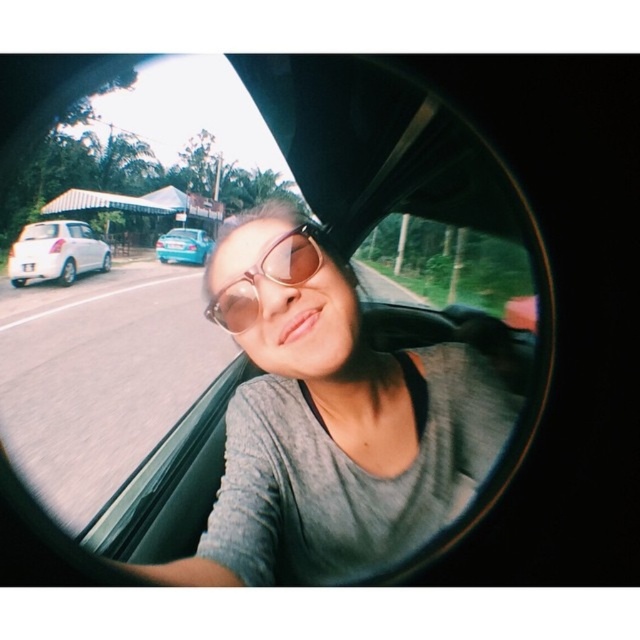
Question: Among these objects, which one is nearest to the camera?

Choices:
 (A) transparent glass car window at center
 (B) teal glossy car at left
 (C) sunglasses at center

Answer: (C)

Question: Which of these objects is positioned farthest from the matte gray shirt at center?

Choices:
 (A) transparent glass car window at center
 (B) white matte hatchback at left

Answer: (B)

Question: Does transparent glass car window at center appear on the right side of sunglasses at center?

Choices:
 (A) no
 (B) yes

Answer: (A)

Question: From the image, what is the correct spatial relationship of matte gray shirt at center in relation to teal glossy car at left?

Choices:
 (A) left
 (B) right

Answer: (B)

Question: Which point is farther from the camera taking this photo?

Choices:
 (A) (56, 243)
 (B) (164, 257)
 (C) (250, 449)
 (D) (230, 557)

Answer: (B)

Question: In this image, where is matte gray shirt at center located relative to teal glossy car at left?

Choices:
 (A) above
 (B) below

Answer: (B)